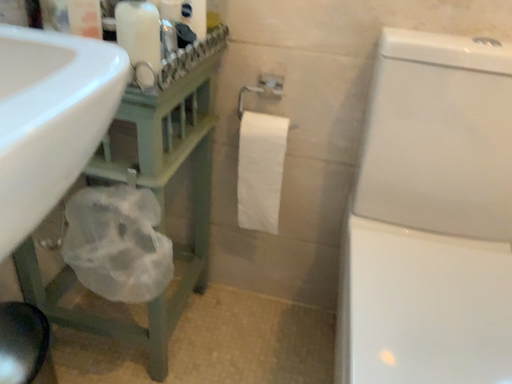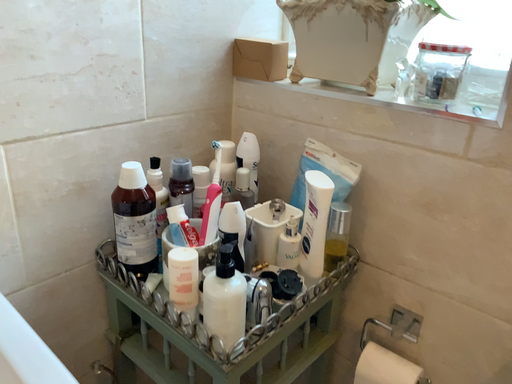
Question: Which way did the camera rotate in the video?

Choices:
 (A) rotated left
 (B) rotated right

Answer: (A)